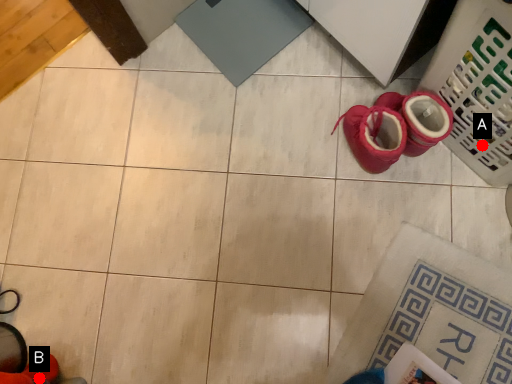
Question: Two points are circled on the image, labeled by A and B beside each circle. Which point is further to the camera?

Choices:
 (A) A is further
 (B) B is further

Answer: (B)